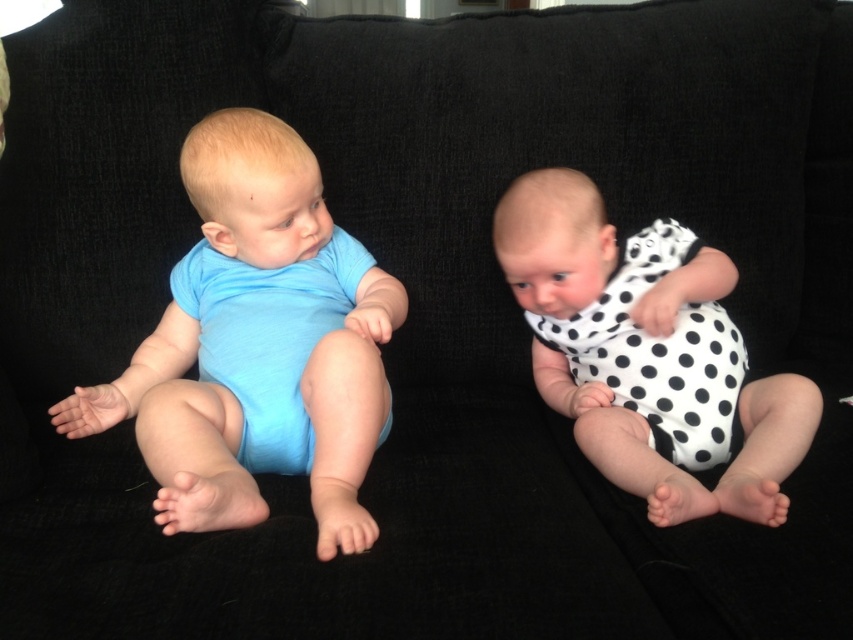
Who is more forward, (233, 412) or (561, 355)?

Positioned in front is point (233, 412).

Which is more to the left, matte blue onesie at left or white dotted fabric at right?

matte blue onesie at left

In order to click on matte blue onesie at left in this screenshot , I will do `click(257, 346)`.